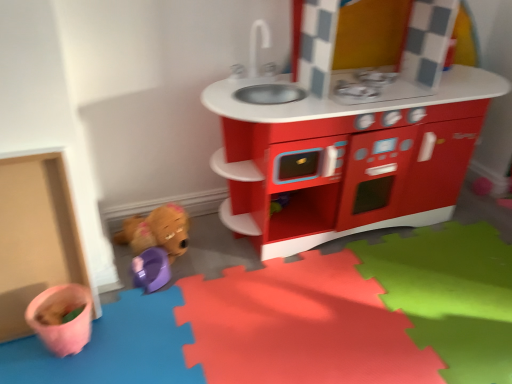
I want to click on unoccupied area in front of purple plastic toy at lower left, which ranks as the first toy in bottom-to-top order, so click(x=144, y=320).